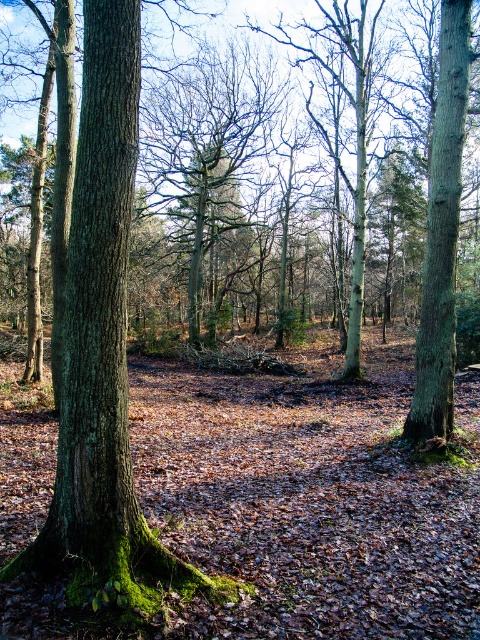
Question: Does green mossy bark tree trunk at left have a smaller size compared to green rough bark tree trunk at right?

Choices:
 (A) no
 (B) yes

Answer: (B)

Question: Can you confirm if smooth bark tree at center is bigger than green rough bark tree trunk at right?

Choices:
 (A) yes
 (B) no

Answer: (A)

Question: Which point appears farthest from the camera in this image?

Choices:
 (A) (443, 67)
 (B) (171, 88)

Answer: (B)

Question: Which point is farther to the camera?

Choices:
 (A) coord(175,230)
 (B) coord(99,534)

Answer: (A)

Question: Observing the image, what is the correct spatial positioning of green mossy bark tree trunk at left in reference to green rough bark tree trunk at right?

Choices:
 (A) right
 (B) left

Answer: (B)

Question: Which of the following is the farthest from the observer?

Choices:
 (A) (441, 292)
 (B) (240, 168)

Answer: (B)